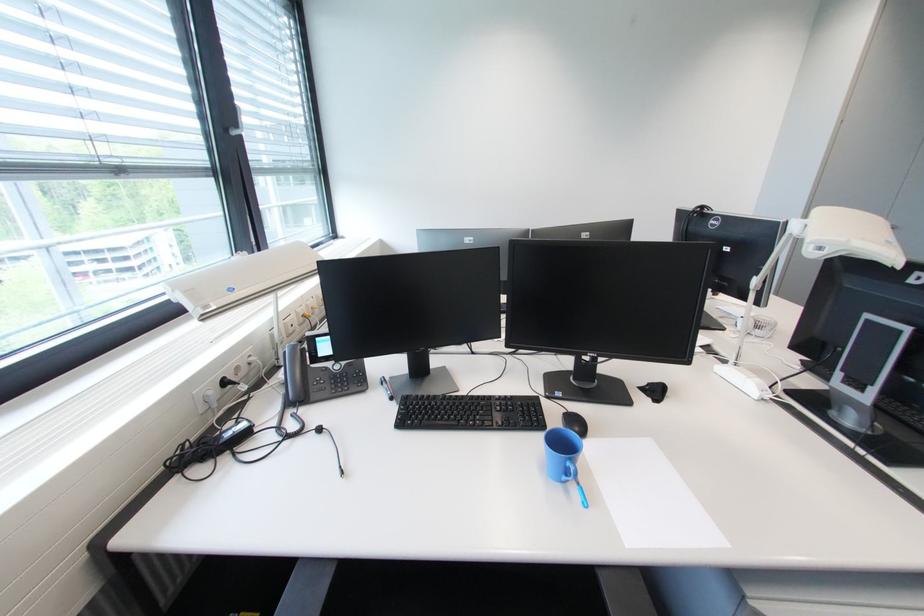
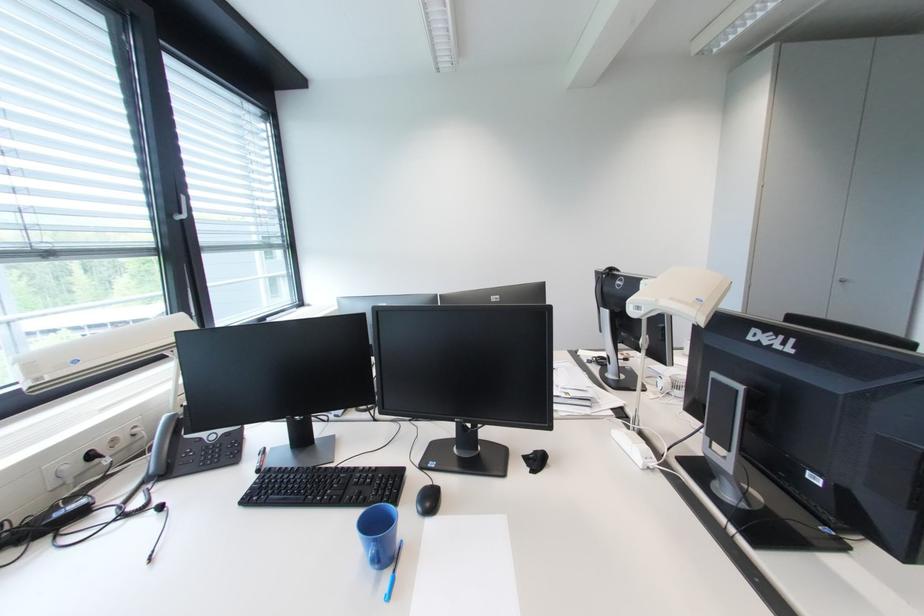
Where in the second image is the point corresponding to point (655, 386) from the first image?

(541, 454)